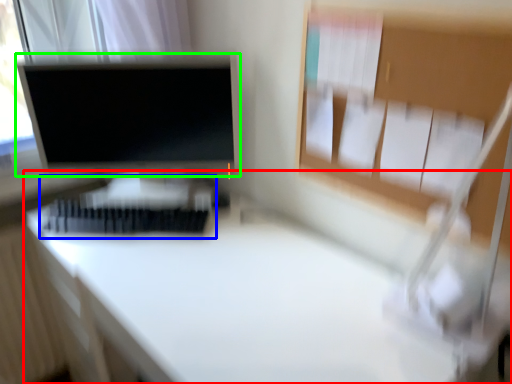
Question: Which object is positioned farthest from desk (highlighted by a red box)? Select from bed (highlighted by a blue box) and computer monitor (highlighted by a green box).

Choices:
 (A) bed
 (B) computer monitor

Answer: (B)